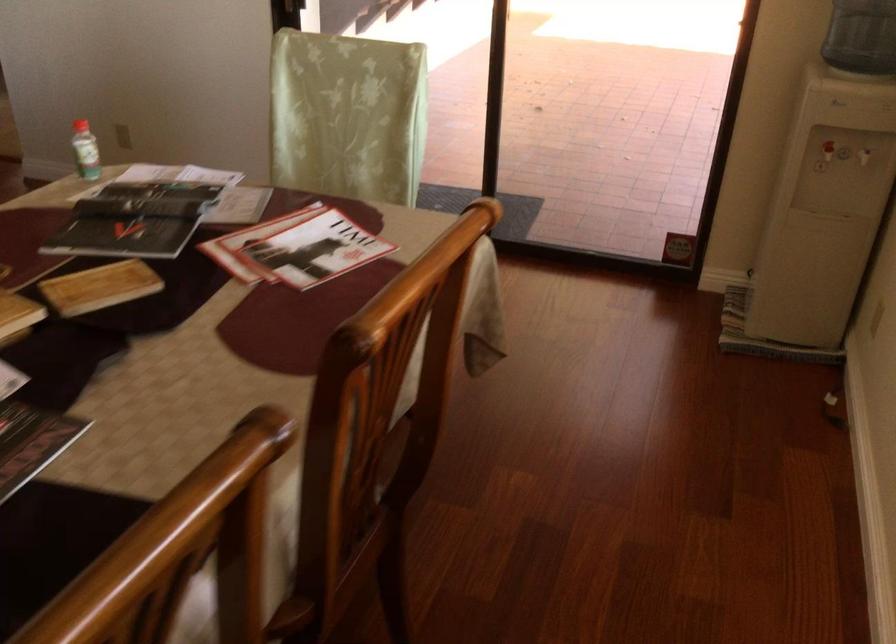
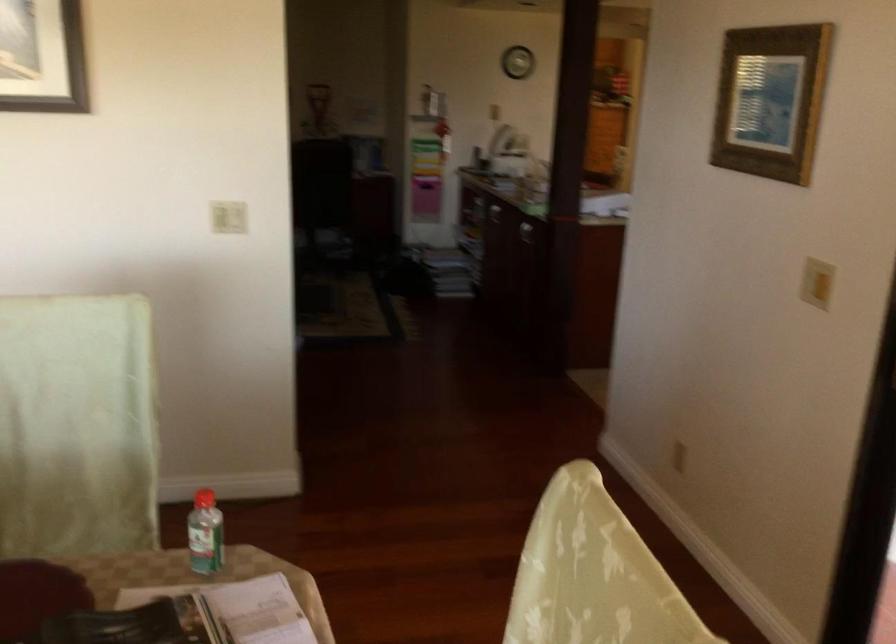
Question: I am providing you with two images of the same scene from different viewpoints. Please identify which objects are invisible in image2.

Choices:
 (A) red bottle cap
 (B) light switch rocker
 (C) open book
 (D) none of these

Answer: (D)